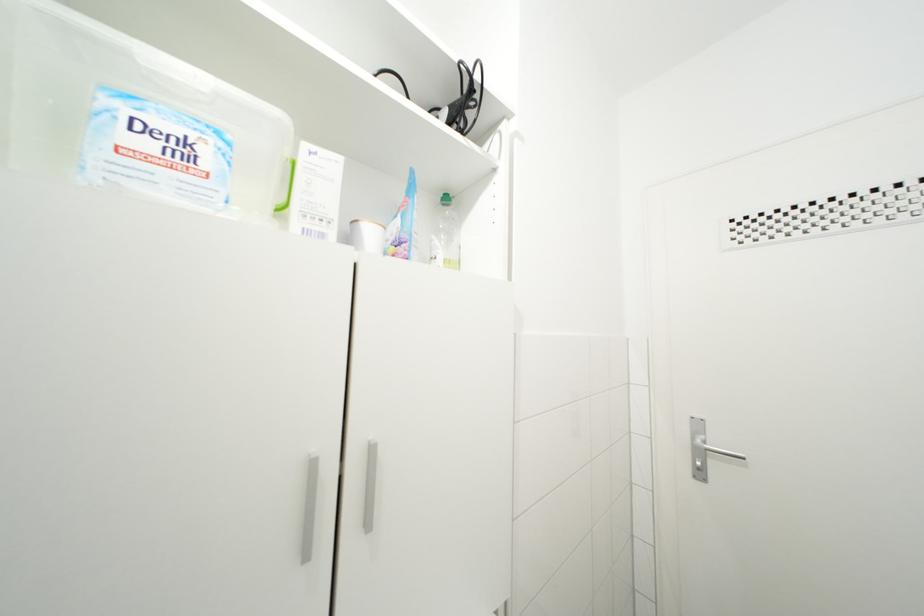
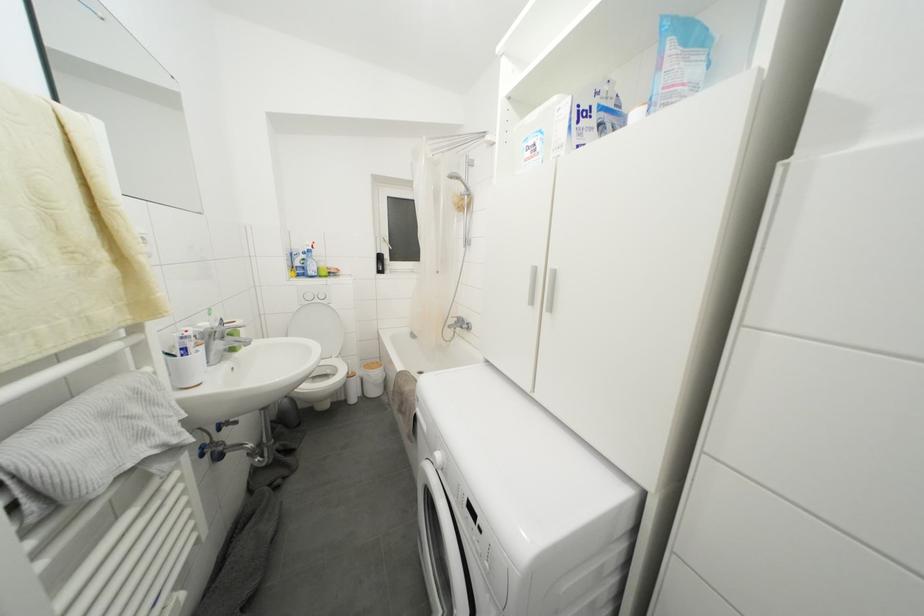
Question: The camera is either moving clockwise (left) or counter-clockwise (right) around the object. The first image is from the beginning of the video and the second image is from the end. Is the camera moving left or right when shooting the video?

Choices:
 (A) Left
 (B) Right

Answer: (B)